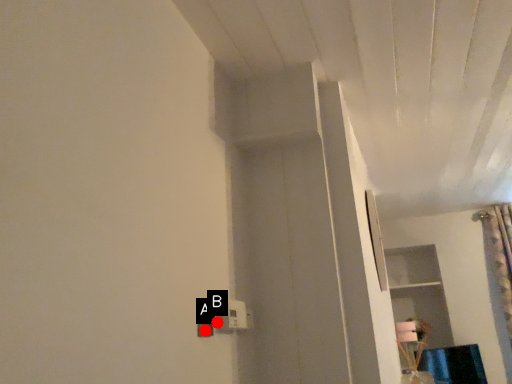
Question: Two points are circled on the image, labeled by A and B beside each circle. Which of the following is the farthest from the observer?

Choices:
 (A) A is further
 (B) B is further

Answer: (B)